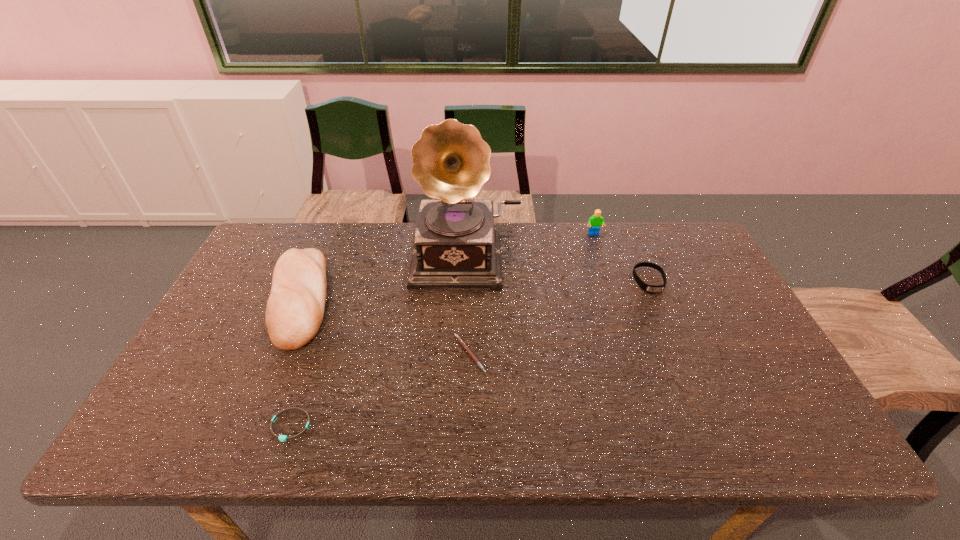
The height and width of the screenshot is (540, 960). Find the location of `vacant area that lies between the pen and the nearer wristband`. vacant area that lies between the pen and the nearer wristband is located at coordinates (380, 390).

Image resolution: width=960 pixels, height=540 pixels. I want to click on free spot between the nearer wristband and the second object from right to left, so click(x=443, y=330).

Locate an element on the screen. The image size is (960, 540). free point between the pen and the shortest object is located at coordinates (380, 390).

Point out which object is positioned as the second nearest to the fifth tallest object. Please provide its 2D coordinates. Your answer should be formatted as a tuple, i.e. [(x, y)], where the tuple contains the x and y coordinates of a point satisfying the conditions above.

[(282, 438)]

Identify which object is the fifth nearest to the shortest object. Please provide its 2D coordinates. Your answer should be formatted as a tuple, i.e. [(x, y)], where the tuple contains the x and y coordinates of a point satisfying the conditions above.

[(596, 220)]

Locate an element on the screen. blank space that satisfies the following two spatial constraints: 1. at the nib of the pen; 2. on the buckle of the nearer wristband is located at coordinates (468, 426).

Where is `free location that satisfies the following two spatial constraints: 1. on the display of the rightmost object; 2. at the nib of the pen`? This screenshot has height=540, width=960. free location that satisfies the following two spatial constraints: 1. on the display of the rightmost object; 2. at the nib of the pen is located at coordinates (680, 354).

Where is `free space that satisfies the following two spatial constraints: 1. on the face of the second object from right to left; 2. at the nib of the pen`? The image size is (960, 540). free space that satisfies the following two spatial constraints: 1. on the face of the second object from right to left; 2. at the nib of the pen is located at coordinates (633, 354).